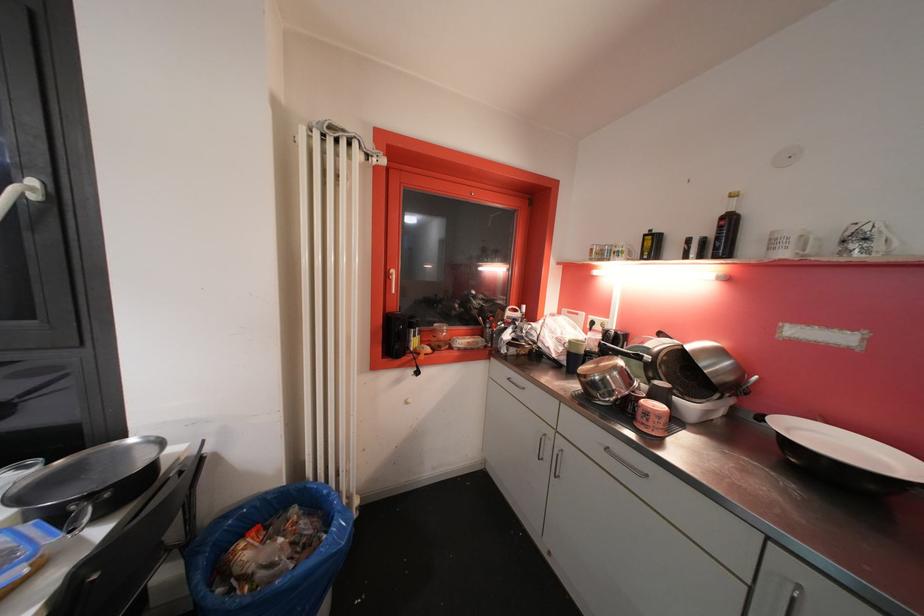
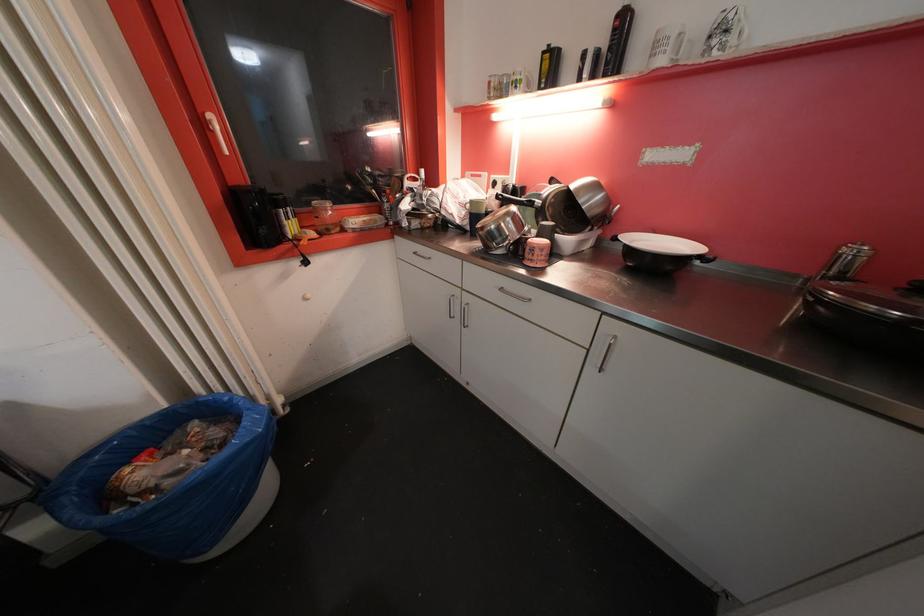
The point at (397,274) is marked in the first image. Where is the corresponding point in the second image?

(215, 119)